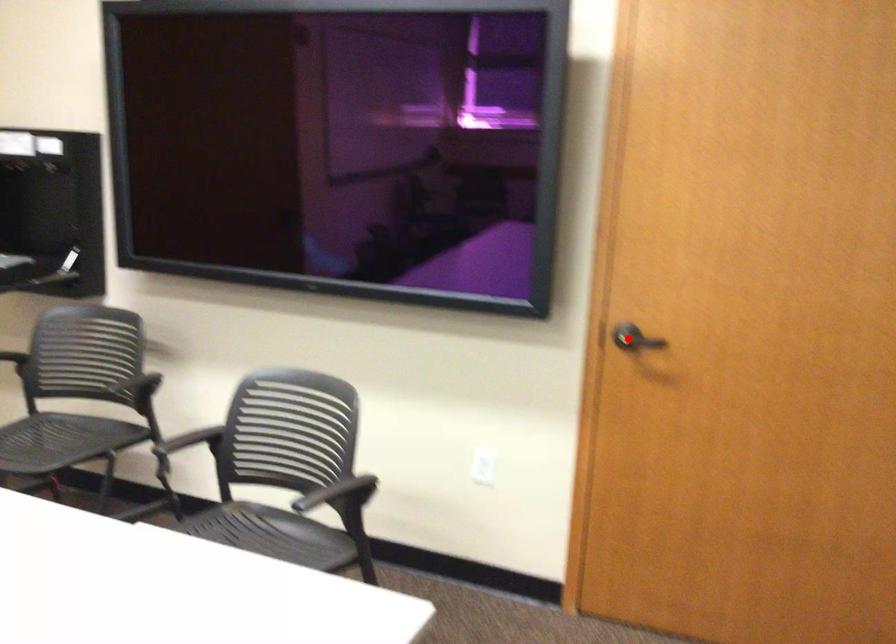
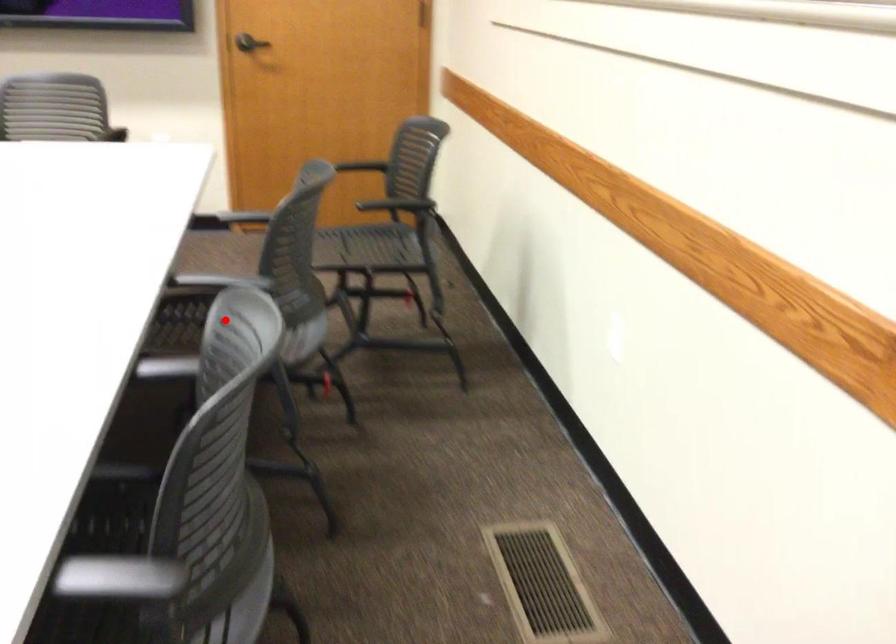
I am providing you with two images of the same scene from different viewpoints. A red point is marked on the first image and another point is marked on the second image. Is the marked point in image1 the same physical position as the marked point in image2?

No